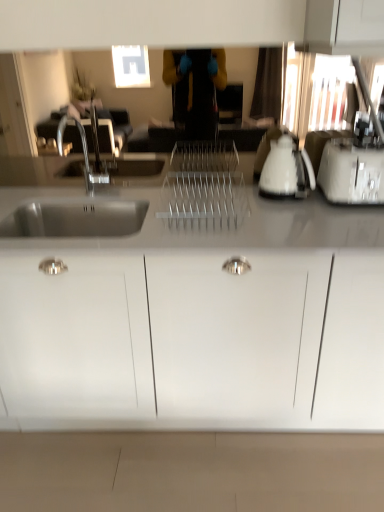
Question: From a real-world perspective, is white glossy electric kettle at right under white matte cabinet at center?

Choices:
 (A) no
 (B) yes

Answer: (A)

Question: Does white glossy electric kettle at right touch white matte cabinet at center?

Choices:
 (A) no
 (B) yes

Answer: (A)

Question: Does white glossy electric kettle at right appear on the right side of white matte cabinet at center?

Choices:
 (A) no
 (B) yes

Answer: (B)

Question: Does white glossy electric kettle at right lie behind white matte cabinet at center?

Choices:
 (A) no
 (B) yes

Answer: (B)

Question: Could you tell me if white glossy electric kettle at right is turned towards white matte cabinet at center?

Choices:
 (A) yes
 (B) no

Answer: (B)

Question: From their relative heights in the image, would you say white matte cabinet at center is taller or shorter than white plastic toaster at right?

Choices:
 (A) short
 (B) tall

Answer: (B)

Question: Do you think white matte cabinet at center is within white plastic toaster at right, or outside of it?

Choices:
 (A) outside
 (B) inside

Answer: (A)

Question: In the image, is white matte cabinet at center positioned in front of or behind white plastic toaster at right?

Choices:
 (A) front
 (B) behind

Answer: (A)

Question: Looking at their shapes, would you say white matte cabinet at center is wider or thinner than white plastic toaster at right?

Choices:
 (A) wide
 (B) thin

Answer: (A)

Question: From a real-world perspective, relative to white glossy electric kettle at right, is white matte cabinet at center vertically above or below?

Choices:
 (A) below
 (B) above

Answer: (A)

Question: From the image's perspective, is white matte cabinet at center positioned above or below white glossy electric kettle at right?

Choices:
 (A) above
 (B) below

Answer: (B)

Question: In terms of width, does white matte cabinet at center look wider or thinner when compared to white glossy electric kettle at right?

Choices:
 (A) wide
 (B) thin

Answer: (A)

Question: Based on their positions, is white matte cabinet at center located to the left or right of white glossy electric kettle at right?

Choices:
 (A) right
 (B) left

Answer: (B)

Question: Would you say white plastic toaster at right is to the left or to the right of white glossy electric kettle at right in the picture?

Choices:
 (A) left
 (B) right

Answer: (B)

Question: From a real-world perspective, is white plastic toaster at right above or below white glossy electric kettle at right?

Choices:
 (A) above
 (B) below

Answer: (B)